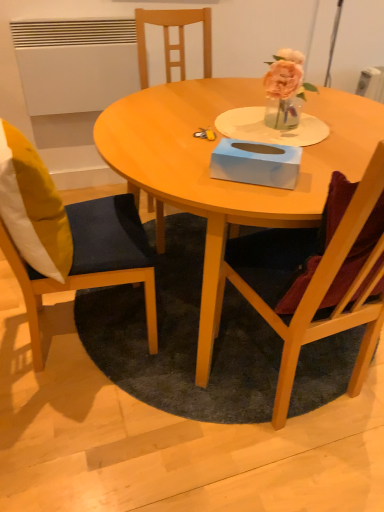
Question: Should I look upward or downward to see yellow fabric pillow at left?

Choices:
 (A) up
 (B) down

Answer: (A)

Question: Can you confirm if dark gray carpet at center is wider than wooden chair at right, arranged as the 2th chair when viewed from the left?

Choices:
 (A) yes
 (B) no

Answer: (A)

Question: Considering the relative positions of dark gray carpet at center and wooden chair at right, arranged as the 2th chair when viewed from the left, in the image provided, is dark gray carpet at center to the right of wooden chair at right, arranged as the 2th chair when viewed from the left, from the viewer's perspective?

Choices:
 (A) no
 (B) yes

Answer: (A)

Question: Considering the relative sizes of dark gray carpet at center and wooden chair at right, arranged as the 2th chair when viewed from the left, in the image provided, is dark gray carpet at center bigger than wooden chair at right, arranged as the 2th chair when viewed from the left,?

Choices:
 (A) no
 (B) yes

Answer: (A)

Question: Can we say dark gray carpet at center lies outside wooden chair at right, arranged as the 2th chair when viewed from the left?

Choices:
 (A) no
 (B) yes

Answer: (B)

Question: Is dark gray carpet at center to the left of wooden chair at right, arranged as the 2th chair when viewed from the left, from the viewer's perspective?

Choices:
 (A) no
 (B) yes

Answer: (B)

Question: Is dark gray carpet at center closer to camera compared to wooden chair at right, arranged as the 2th chair when viewed from the left?

Choices:
 (A) yes
 (B) no

Answer: (B)

Question: From the image's perspective, is wooden chair at left, the first chair in the left-to-right sequence, under wooden table at center?

Choices:
 (A) yes
 (B) no

Answer: (A)

Question: Is wooden chair at left, which is counted as the 2th chair, starting from the right, smaller than wooden table at center?

Choices:
 (A) yes
 (B) no

Answer: (A)

Question: Is wooden chair at left, the first chair in the left-to-right sequence, wider than wooden table at center?

Choices:
 (A) no
 (B) yes

Answer: (A)

Question: Is wooden chair at left, the first chair in the left-to-right sequence, further to the viewer compared to wooden table at center?

Choices:
 (A) no
 (B) yes

Answer: (A)

Question: Does wooden chair at left, the first chair in the left-to-right sequence, contain wooden table at center?

Choices:
 (A) yes
 (B) no

Answer: (B)

Question: Is there a large distance between wooden chair at left, the first chair in the left-to-right sequence, and wooden table at center?

Choices:
 (A) yes
 (B) no

Answer: (B)

Question: From the image's perspective, is light blue cardboard tissue box at center under wooden table at center?

Choices:
 (A) yes
 (B) no

Answer: (B)